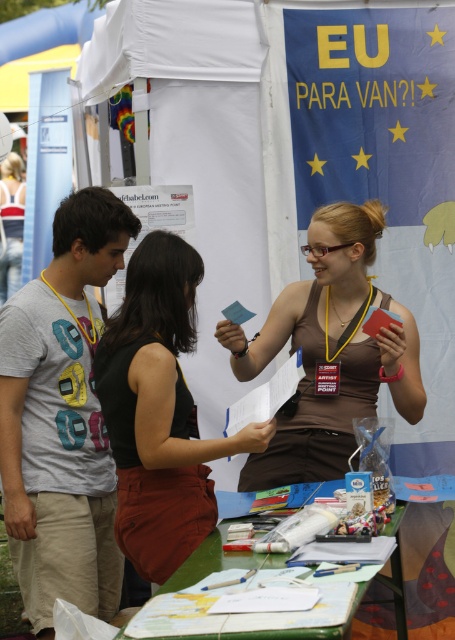
Based on the photo, how distant is gray cotton t-shirt at left from green painted wood table at lower center?

gray cotton t-shirt at left and green painted wood table at lower center are 3.50 feet apart from each other.

Is gray cotton t-shirt at left to the left of green painted wood table at lower center from the viewer's perspective?

Correct, you'll find gray cotton t-shirt at left to the left of green painted wood table at lower center.

The width and height of the screenshot is (455, 640). Identify the location of gray cotton t-shirt at left. (61, 419).

Is green painted wood table at lower center thinner than matte black tank top at center?

No, green painted wood table at lower center is not thinner than matte black tank top at center.

Is point (283, 632) closer to viewer compared to point (0, 301)?

Yes, point (283, 632) is in front of point (0, 301).

The image size is (455, 640). What are the coordinates of `green painted wood table at lower center` in the screenshot? It's located at (215, 563).

Between point (60, 252) and point (18, 186), which one is positioned in front?

Positioned in front is point (60, 252).

Does gray cotton t-shirt at left appear on the right side of matte black tank top at center?

Correct, you'll find gray cotton t-shirt at left to the right of matte black tank top at center.

Is point (69, 536) more distant than point (18, 220)?

No, (69, 536) is in front of (18, 220).

Locate an element on the screen. This screenshot has height=640, width=455. gray cotton t-shirt at left is located at coordinates (61, 419).